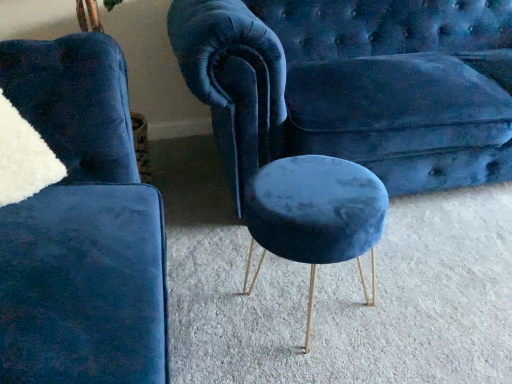
What is the approximate width of velvet blue couch at center?

velvet blue couch at center is 36.19 inches wide.

Where is `velvet blue stool at center`? The height and width of the screenshot is (384, 512). velvet blue stool at center is located at coordinates (315, 215).

Identify the location of velvet blue couch at center. (355, 85).

Is point (113, 230) behind point (331, 172)?

No, it is not.

Would you say velvet blue stool at lower left is to the left or to the right of velvet blue stool at center in the picture?

Clearly, velvet blue stool at lower left is on the left of velvet blue stool at center in the image.

Is velvet blue stool at lower left wider or thinner than velvet blue stool at center?

Considering their sizes, velvet blue stool at lower left looks broader than velvet blue stool at center.

How distant is velvet blue stool at center from velvet blue couch at center?

A distance of 18.04 inches exists between velvet blue stool at center and velvet blue couch at center.

From a real-world perspective, is velvet blue stool at center above or below velvet blue couch at center?

From a real-world perspective, velvet blue stool at center is physically below velvet blue couch at center.

From the image's perspective, is velvet blue stool at center above or below velvet blue couch at center?

velvet blue stool at center is situated lower than velvet blue couch at center in the image.

Which of these two, velvet blue stool at center or velvet blue couch at center, is smaller?

Smaller between the two is velvet blue stool at center.

Considering the sizes of objects velvet blue couch at center and velvet blue stool at lower left in the image provided, who is taller, velvet blue couch at center or velvet blue stool at lower left?

Standing taller between the two is velvet blue stool at lower left.

Which is less distant, (447,129) or (8,62)?

The point (8,62) is closer to the camera.

Considering the relative positions of velvet blue couch at center and velvet blue stool at lower left in the image provided, is velvet blue couch at center to the left of velvet blue stool at lower left from the viewer's perspective?

No.

From the image's perspective, between velvet blue couch at center and velvet blue stool at lower left, who is located below?

velvet blue stool at lower left.

Is velvet blue stool at center a part of velvet blue couch at center?

Definitely not — velvet blue stool at center is not inside velvet blue couch at center.

From the image's perspective, is velvet blue couch at center below velvet blue stool at center?

Actually, velvet blue couch at center appears above velvet blue stool at center in the image.

Is velvet blue couch at center bigger than velvet blue stool at center?

Indeed, velvet blue couch at center has a larger size compared to velvet blue stool at center.

From a real-world perspective, is velvet blue couch at center below velvet blue stool at center?

No.

Would you say velvet blue stool at lower left contains velvet blue couch at center?

That's incorrect, velvet blue couch at center is not inside velvet blue stool at lower left.

Which is behind, velvet blue stool at lower left or velvet blue couch at center?

Positioned behind is velvet blue couch at center.

Measure the distance from velvet blue stool at lower left to velvet blue couch at center.

The distance of velvet blue stool at lower left from velvet blue couch at center is 72.52 centimeters.

Locate an element on the screen. studio couch below the velvet blue stool at lower left (from a real-world perspective) is located at coordinates (355, 85).

Locate an element on the screen. The width and height of the screenshot is (512, 384). stool below the velvet blue stool at lower left (from a real-world perspective) is located at coordinates (315, 215).

Can you see velvet blue stool at center touching velvet blue stool at lower left?

No, velvet blue stool at center is not touching velvet blue stool at lower left.

Considering the relative positions of velvet blue stool at center and velvet blue stool at lower left in the image provided, is velvet blue stool at center behind velvet blue stool at lower left?

Yes, it is behind velvet blue stool at lower left.

How much distance is there between velvet blue stool at center and velvet blue stool at lower left?

They are 15.67 inches apart.

Where is `stool below the velvet blue stool at lower left (from the image's perspective)`? This screenshot has height=384, width=512. stool below the velvet blue stool at lower left (from the image's perspective) is located at coordinates (315, 215).

I want to click on studio couch on the right of velvet blue stool at center, so click(x=355, y=85).

Considering their positions, is velvet blue stool at lower left positioned closer to velvet blue couch at center than velvet blue stool at center?

The object closer to velvet blue couch at center is velvet blue stool at center.

From the image, which object appears to be nearer to velvet blue couch at center, velvet blue stool at center or velvet blue stool at lower left?

Among the two, velvet blue stool at center is located nearer to velvet blue couch at center.

From the image, which object appears to be farther from velvet blue stool at lower left, velvet blue stool at center or velvet blue couch at center?

Based on the image, velvet blue couch at center appears to be further to velvet blue stool at lower left.

Estimate the real-world distances between objects in this image. Which object is closer to velvet blue stool at center, velvet blue couch at center or velvet blue stool at lower left?

velvet blue stool at lower left lies closer to velvet blue stool at center than the other object.

Looking at this image, from the image, which object appears to be nearer to velvet blue stool at lower left, velvet blue couch at center or velvet blue stool at center?

Among the two, velvet blue stool at center is located nearer to velvet blue stool at lower left.

Based on their spatial positions, is velvet blue stool at lower left or velvet blue couch at center further from velvet blue stool at center?

Based on the image, velvet blue couch at center appears to be further to velvet blue stool at center.

Find the location of a particular element. This screenshot has width=512, height=384. stool between velvet blue stool at lower left and velvet blue couch at center in the horizontal direction is located at coordinates (315, 215).